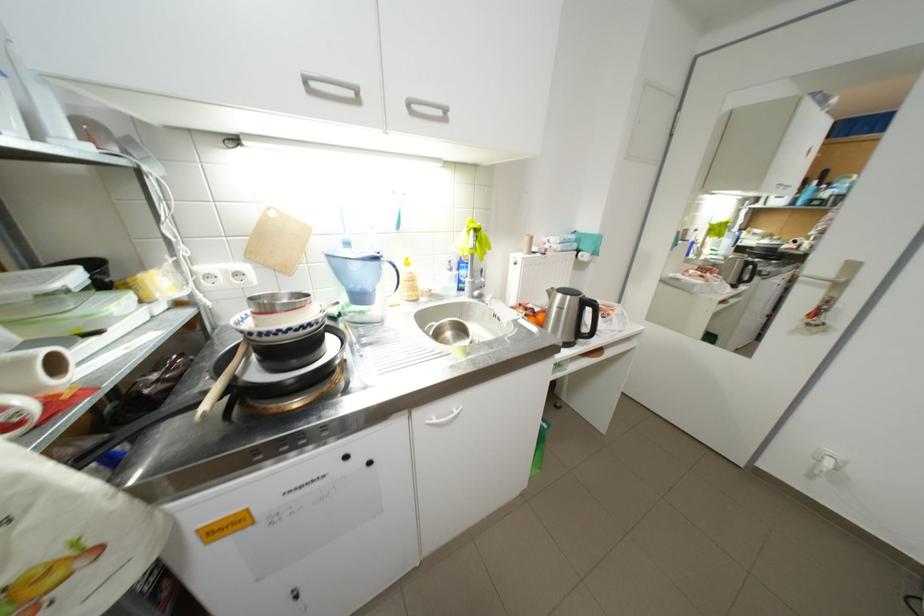
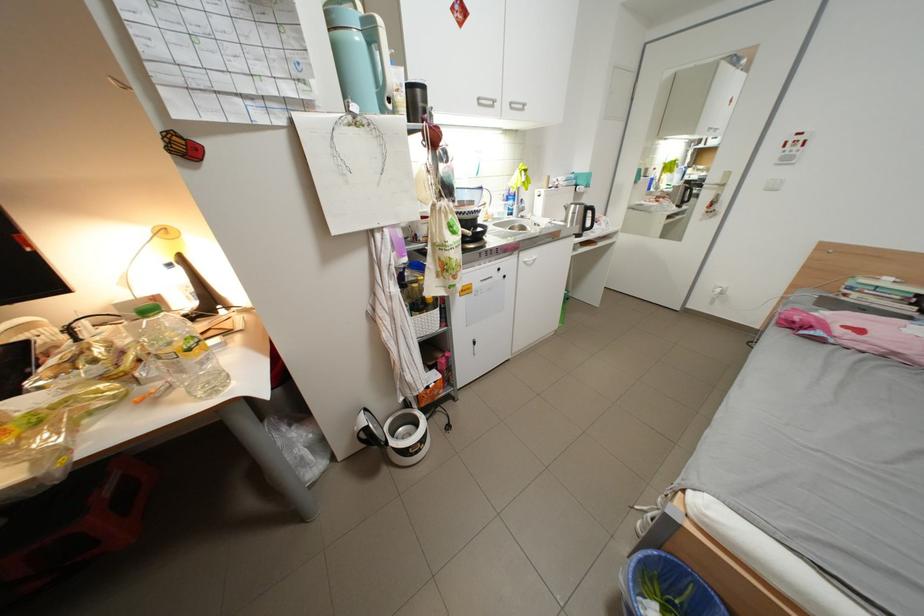
The point at [420,105] is marked in the first image. Where is the corresponding point in the second image?

(523, 105)